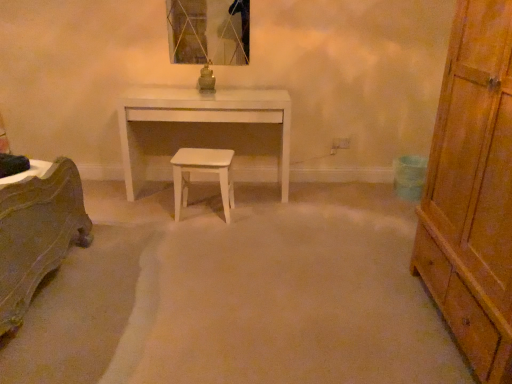
Question: In terms of width, does white matte stool at center look wider or thinner when compared to white glossy desk at center?

Choices:
 (A) thin
 (B) wide

Answer: (A)

Question: From a real-world perspective, is white matte stool at center positioned above or below white glossy desk at center?

Choices:
 (A) below
 (B) above

Answer: (A)

Question: Which object is the closest to the white glossy desk at center?

Choices:
 (A) wooden chest of drawers at right
 (B) white matte stool at center
 (C) metallic glass mirror at upper center

Answer: (B)

Question: Which of these objects is positioned closest to the white glossy desk at center?

Choices:
 (A) wooden chest of drawers at right
 (B) white matte stool at center
 (C) metallic glass mirror at upper center

Answer: (B)